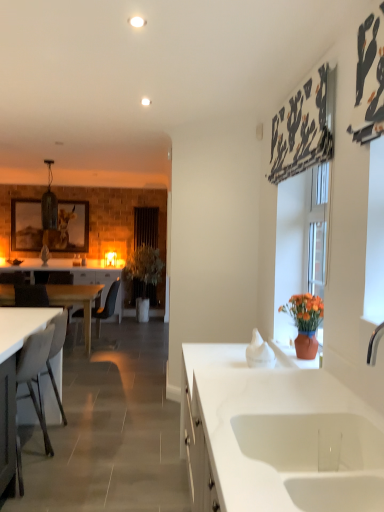
Question: Can you confirm if white ceramic sink at lower center is taller than white wood desk at left, positioned as the first desk in left-to-right order?

Choices:
 (A) no
 (B) yes

Answer: (A)

Question: Is white ceramic sink at lower center behind white wood desk at left, placed as the 1th desk when sorted from back to front?

Choices:
 (A) yes
 (B) no

Answer: (B)

Question: Is white ceramic sink at lower center at the right side of white wood desk at left, placed as the 2th desk when sorted from right to left?

Choices:
 (A) no
 (B) yes

Answer: (B)

Question: Considering the relative sizes of white ceramic sink at lower center and white wood desk at left, placed as the 2th desk when sorted from right to left, in the image provided, is white ceramic sink at lower center wider than white wood desk at left, placed as the 2th desk when sorted from right to left,?

Choices:
 (A) no
 (B) yes

Answer: (A)

Question: Is white wood desk at left, positioned as the first desk in left-to-right order, completely or partially inside white ceramic sink at lower center?

Choices:
 (A) yes
 (B) no

Answer: (B)

Question: Does white ceramic sink at lower center have a smaller size compared to white wood desk at left, placed as the 2th desk when sorted from right to left?

Choices:
 (A) no
 (B) yes

Answer: (B)

Question: From a real-world perspective, is white matte chair at left, which is the 1th armchair in front-to-back order, under black fabric curtain at center?

Choices:
 (A) yes
 (B) no

Answer: (A)

Question: Could you tell me if white matte chair at left, which is the 2th armchair in back-to-front order, is facing black fabric curtain at center?

Choices:
 (A) no
 (B) yes

Answer: (A)

Question: Is white matte chair at left, which is the 1th armchair in front-to-back order, to the right of black fabric curtain at center from the viewer's perspective?

Choices:
 (A) no
 (B) yes

Answer: (A)

Question: Does white matte chair at left, which is the 2th armchair in back-to-front order, have a lesser width compared to black fabric curtain at center?

Choices:
 (A) yes
 (B) no

Answer: (B)

Question: Can you confirm if white matte chair at left, the first armchair when ordered from right to left, is shorter than black fabric curtain at center?

Choices:
 (A) no
 (B) yes

Answer: (B)

Question: Does white matte chair at left, the 2th armchair in the left-to-right sequence, appear on the left side of black fabric curtain at center?

Choices:
 (A) no
 (B) yes

Answer: (B)

Question: Is wooden framed picture at left shorter than white matte desk at lower left, which is counted as the 1th desk, starting from the front?

Choices:
 (A) no
 (B) yes

Answer: (A)